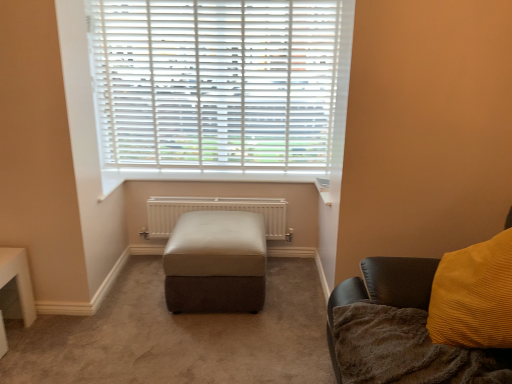
Question: Can you confirm if brown fuzzy blanket at lower right is smaller than leather ottoman at center?

Choices:
 (A) yes
 (B) no

Answer: (A)

Question: From a real-world perspective, is brown fuzzy blanket at lower right on leather ottoman at center?

Choices:
 (A) yes
 (B) no

Answer: (A)

Question: Is brown fuzzy blanket at lower right positioned in front of leather ottoman at center?

Choices:
 (A) yes
 (B) no

Answer: (A)

Question: Is the surface of brown fuzzy blanket at lower right in direct contact with leather ottoman at center?

Choices:
 (A) no
 (B) yes

Answer: (A)

Question: Is brown fuzzy blanket at lower right positioned beyond the bounds of leather ottoman at center?

Choices:
 (A) yes
 (B) no

Answer: (A)

Question: Considering the positions of point (394, 362) and point (328, 87), is point (394, 362) closer or farther from the camera than point (328, 87)?

Choices:
 (A) farther
 (B) closer

Answer: (B)

Question: Considering their positions, is brown fuzzy blanket at lower right located in front of or behind white plastic blinds at upper center?

Choices:
 (A) behind
 (B) front

Answer: (B)

Question: Considering the positions of brown fuzzy blanket at lower right and white plastic blinds at upper center in the image, is brown fuzzy blanket at lower right wider or thinner than white plastic blinds at upper center?

Choices:
 (A) thin
 (B) wide

Answer: (B)

Question: From the image's perspective, is brown fuzzy blanket at lower right positioned above or below white plastic blinds at upper center?

Choices:
 (A) above
 (B) below

Answer: (B)

Question: Which is correct: white plastic blinds at upper center is inside white metallic radiator at center, or outside of it?

Choices:
 (A) inside
 (B) outside

Answer: (B)

Question: Is white plastic blinds at upper center taller or shorter than white metallic radiator at center?

Choices:
 (A) tall
 (B) short

Answer: (A)

Question: Is white plastic blinds at upper center bigger or smaller than white metallic radiator at center?

Choices:
 (A) small
 (B) big

Answer: (B)

Question: Considering their positions, is white plastic blinds at upper center located in front of or behind white metallic radiator at center?

Choices:
 (A) behind
 (B) front

Answer: (B)

Question: Is leather ottoman at center inside or outside of white metallic radiator at center?

Choices:
 (A) outside
 (B) inside

Answer: (A)

Question: Looking at their shapes, would you say leather ottoman at center is wider or thinner than white metallic radiator at center?

Choices:
 (A) thin
 (B) wide

Answer: (B)